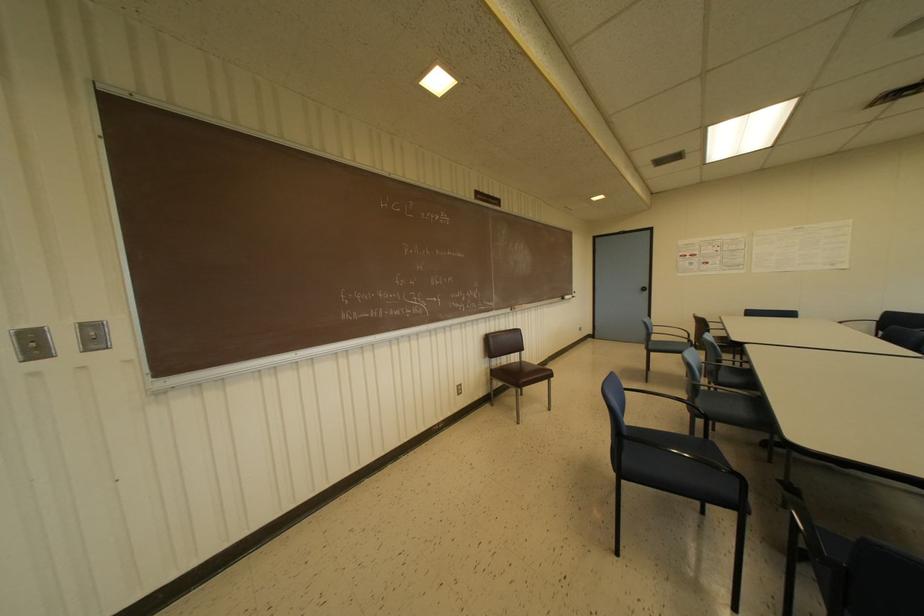
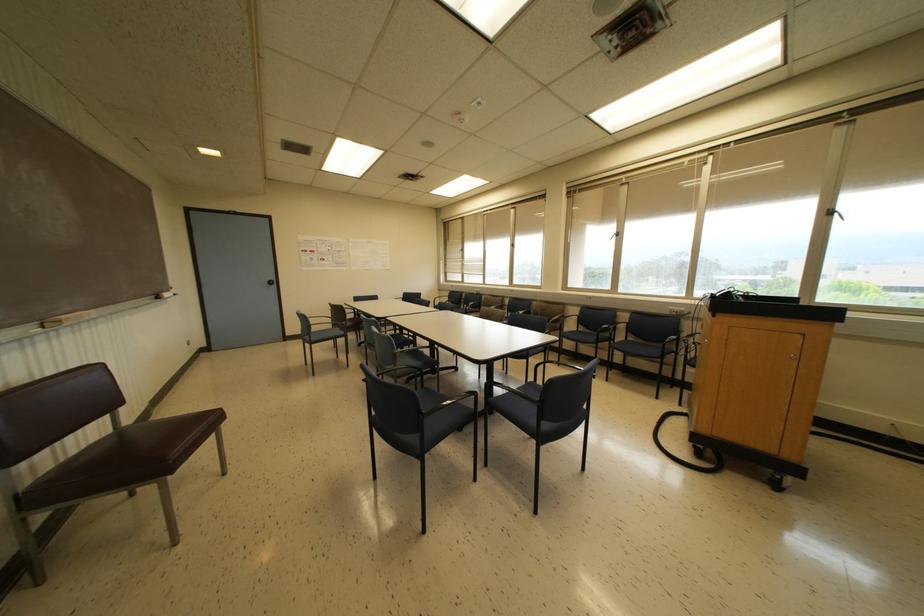
Question: The camera is either moving clockwise (left) or counter-clockwise (right) around the object. The first image is from the beginning of the video and the second image is from the end. Is the camera moving left or right when shooting the video?

Choices:
 (A) Left
 (B) Right

Answer: (A)